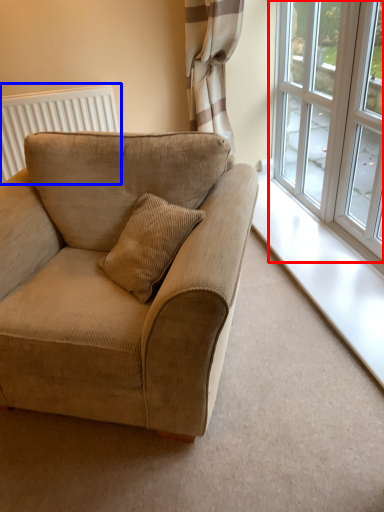
Question: Which object is closer to the camera taking this photo, window (highlighted by a red box) or radiator (highlighted by a blue box)?

Choices:
 (A) window
 (B) radiator

Answer: (A)